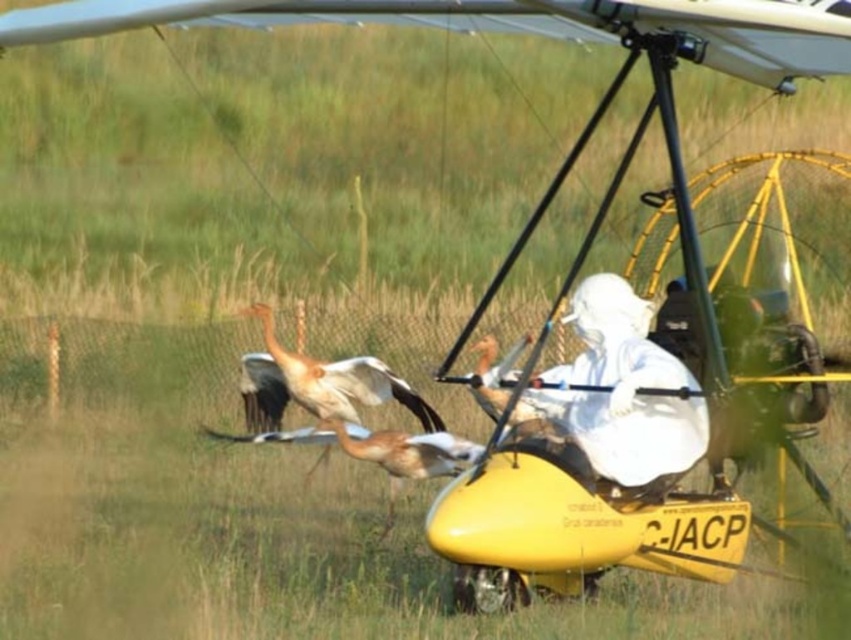
Question: In this image, where is white matte suit at center located relative to brown feathered bird at center?

Choices:
 (A) below
 (B) above

Answer: (B)

Question: Which object is the farthest from the white matte suit at center?

Choices:
 (A) brown feathered bird at center
 (B) white feathered bird at center

Answer: (B)

Question: Is white matte suit at center smaller than white feathered bird at center?

Choices:
 (A) yes
 (B) no

Answer: (A)

Question: Does white matte suit at center appear on the right side of brown feathered bird at center?

Choices:
 (A) no
 (B) yes

Answer: (B)

Question: Which object appears farthest from the camera in this image?

Choices:
 (A) brown feathered bird at center
 (B) white matte suit at center
 (C) white feathered bird at center

Answer: (C)

Question: Which of the following is the closest to the observer?

Choices:
 (A) (237, 438)
 (B) (591, 276)
 (C) (361, 392)

Answer: (B)